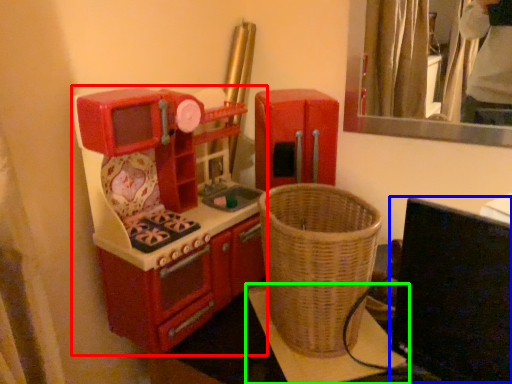
Question: Based on their relative distances, which object is farther from appliance (highlighted by a red box)? Choose from computer monitor (highlighted by a blue box) and furniture (highlighted by a green box).

Choices:
 (A) computer monitor
 (B) furniture

Answer: (A)